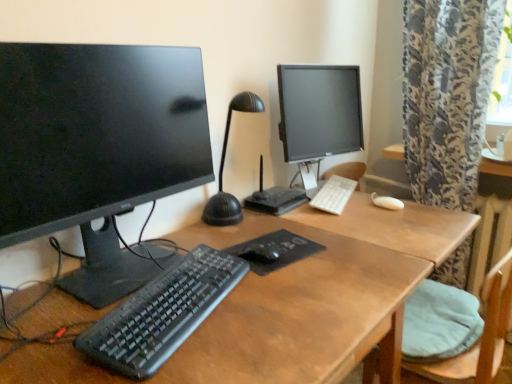
Locate an element on the screen. This screenshot has width=512, height=384. vacant space behind black matte mouse at center is located at coordinates (264, 223).